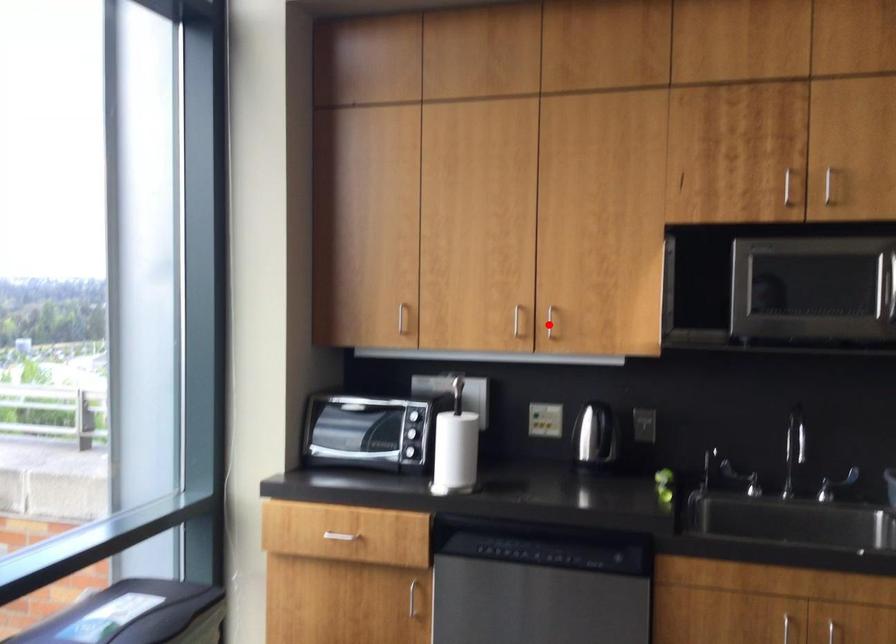
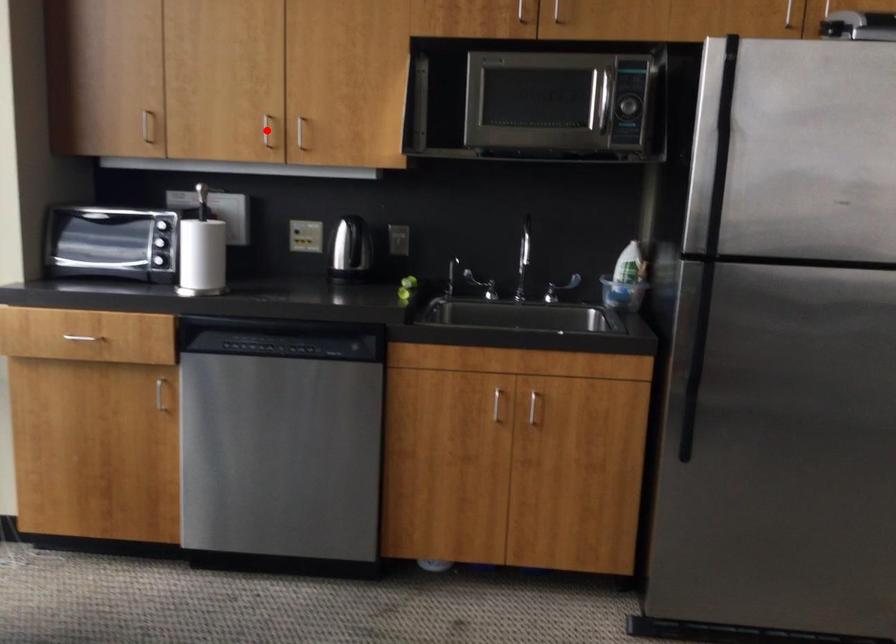
I am providing you with two images of the same scene from different viewpoints. A red point is marked on the first image and another point is marked on the second image. Do the highlighted points in image1 and image2 indicate the same real-world spot?

No